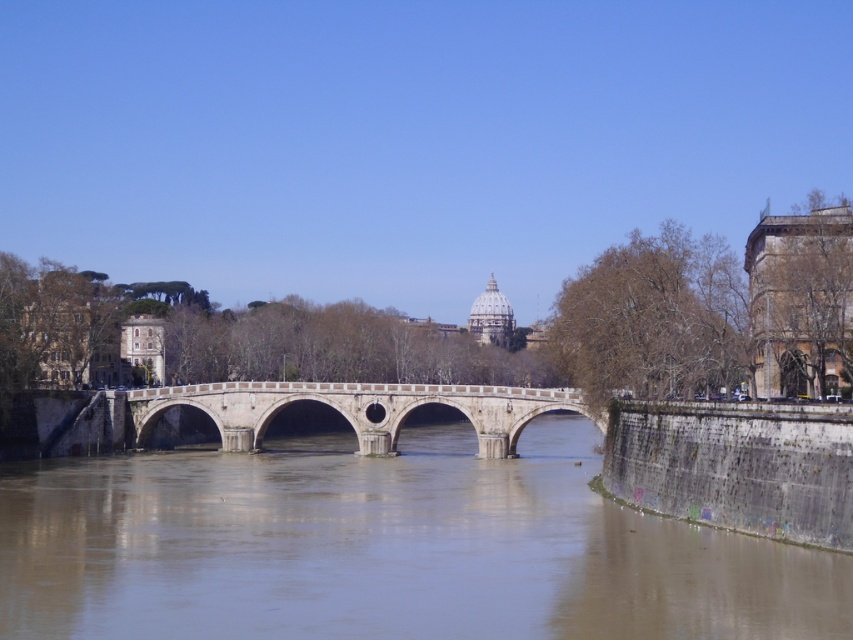
Can you confirm if brown concrete river at center is bigger than white stone arch bridge at center?

Correct, brown concrete river at center is larger in size than white stone arch bridge at center.

Does point (9, 563) come closer to viewer compared to point (279, 385)?

Yes, it is.

This screenshot has width=853, height=640. In order to click on brown concrete river at center in this screenshot , I will do point(386,548).